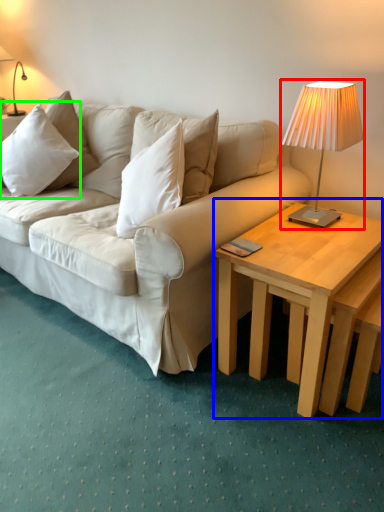
Question: Estimate the real-world distances between objects in this image. Which object is farther from lamp (highlighted by a red box), coffee table (highlighted by a blue box) or pillow (highlighted by a green box)?

Choices:
 (A) coffee table
 (B) pillow

Answer: (B)